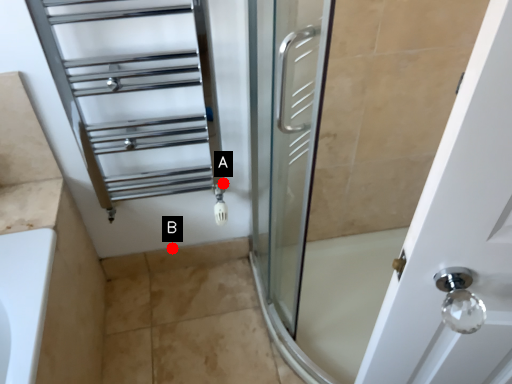
Question: Two points are circled on the image, labeled by A and B beside each circle. Which point is closer to the camera?

Choices:
 (A) A is closer
 (B) B is closer

Answer: (A)